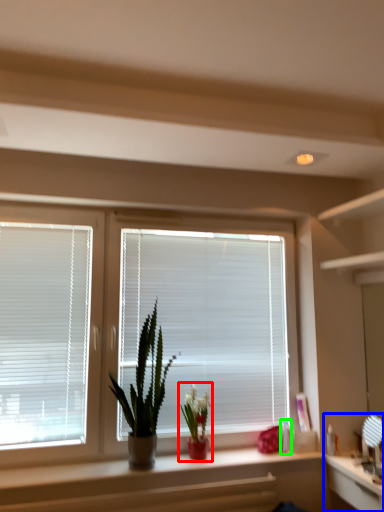
Question: Considering the real-world distances, which object is farthest from houseplant (highlighted by a red box)? computer (highlighted by a blue box) or toiletry (highlighted by a green box)?

Choices:
 (A) computer
 (B) toiletry

Answer: (A)